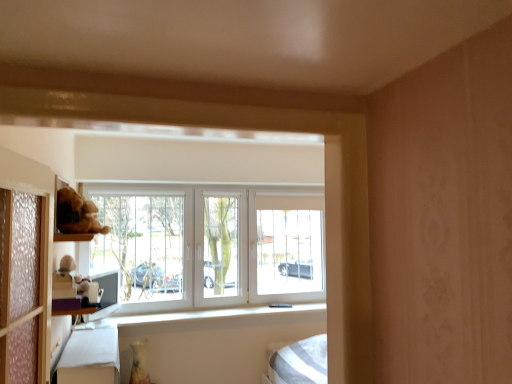
Describe the element at coordinates (90, 357) in the screenshot. I see `white fabric bed frame at lower left` at that location.

Where is `white fabric bed frame at lower left`? The height and width of the screenshot is (384, 512). white fabric bed frame at lower left is located at coordinates (90, 357).

Identify the location of bed frame on the right of white plush toy at left. The width and height of the screenshot is (512, 384). (90, 357).

Does white plush toy at left appear on the right side of white fabric bed frame at lower left?

No.

Is white plush toy at left taller or shorter than white fabric bed frame at lower left?

Considering their sizes, white plush toy at left has less height than white fabric bed frame at lower left.

From a real-world perspective, is white plastic window at center located higher than white fabric bed frame at lower left?

Yes, from a real-world perspective, white plastic window at center is over white fabric bed frame at lower left

Is white plastic window at center beside white fabric bed frame at lower left?

No.

Considering the relative sizes of white plastic window at center and white fabric bed frame at lower left in the image provided, is white plastic window at center thinner than white fabric bed frame at lower left?

Correct, the width of white plastic window at center is less than that of white fabric bed frame at lower left.

From the image's perspective, which is above, white plastic window at center or white fabric bed frame at lower left?

white plastic window at center, from the image's perspective.

The height and width of the screenshot is (384, 512). Identify the location of window that is on the right side of white plush toy at left. (200, 246).

Choose the correct answer: Is white plush toy at left inside white plastic window at center or outside it?

white plush toy at left lies outside white plastic window at center.

Looking at this image, is white plush toy at left in contact with white plastic window at center?

There is a gap between white plush toy at left and white plastic window at center.

How much distance is there between white fabric bed frame at lower left and white plastic window at center?

white fabric bed frame at lower left is 1.12 meters from white plastic window at center.

Which of these two, white fabric bed frame at lower left or white plastic window at center, is smaller?

white fabric bed frame at lower left.

Can you confirm if white fabric bed frame at lower left is shorter than white plastic window at center?

Indeed, white fabric bed frame at lower left has a lesser height compared to white plastic window at center.

Considering their positions, is white fabric bed frame at lower left located in front of or behind white plastic window at center?

Clearly, white fabric bed frame at lower left is in front of white plastic window at center.

Does white plastic window at center have a larger size compared to white plush toy at left?

Yes, white plastic window at center is bigger than white plush toy at left.

Considering the positions of objects white plastic window at center and white plush toy at left in the image provided, who is in front, white plastic window at center or white plush toy at left?

white plush toy at left is in front.

Looking at this image, is white plastic window at center positioned with its back to white plush toy at left?

That's not correct — white plastic window at center is not looking away from white plush toy at left.

Can you tell me how much white plastic window at center and white plush toy at left differ in facing direction?

The facing directions of white plastic window at center and white plush toy at left are 102 degrees apart.

From a real-world perspective, between white fabric bed frame at lower left and white plush toy at left, who is vertically lower?

In real-world perspective, white fabric bed frame at lower left is lower.

Is white fabric bed frame at lower left to the left of white plush toy at left from the viewer's perspective?

In fact, white fabric bed frame at lower left is to the right of white plush toy at left.

Which of these two, white fabric bed frame at lower left or white plush toy at left, is wider?

Wider between the two is white fabric bed frame at lower left.

The image size is (512, 384). Identify the location of bed frame below the white plush toy at left (from a real-world perspective). (90, 357).

This screenshot has height=384, width=512. I want to click on window behind the white fabric bed frame at lower left, so pyautogui.click(x=200, y=246).

Looking at the image, which one is located closer to white plush toy at left, white plastic window at center or white fabric bed frame at lower left?

The object closer to white plush toy at left is white fabric bed frame at lower left.

When comparing their distances from white plush toy at left, does white fabric bed frame at lower left or white plastic window at center seem further?

Based on the image, white plastic window at center appears to be further to white plush toy at left.

From the image, which object appears to be nearer to white fabric bed frame at lower left, white plastic window at center or white plush toy at left?

white plush toy at left.

Looking at the image, which one is located closer to white plastic window at center, white fabric bed frame at lower left or white plush toy at left?

white fabric bed frame at lower left.

Based on their spatial positions, is white plush toy at left or white fabric bed frame at lower left further from white plastic window at center?

The object further to white plastic window at center is white plush toy at left.

Considering their positions, is white plush toy at left positioned closer to white fabric bed frame at lower left than white plastic window at center?

Based on the image, white plush toy at left appears to be nearer to white fabric bed frame at lower left.

Where is `toy between white fabric bed frame at lower left and white plastic window at center in the front-back direction`? This screenshot has height=384, width=512. toy between white fabric bed frame at lower left and white plastic window at center in the front-back direction is located at coordinates (69, 281).